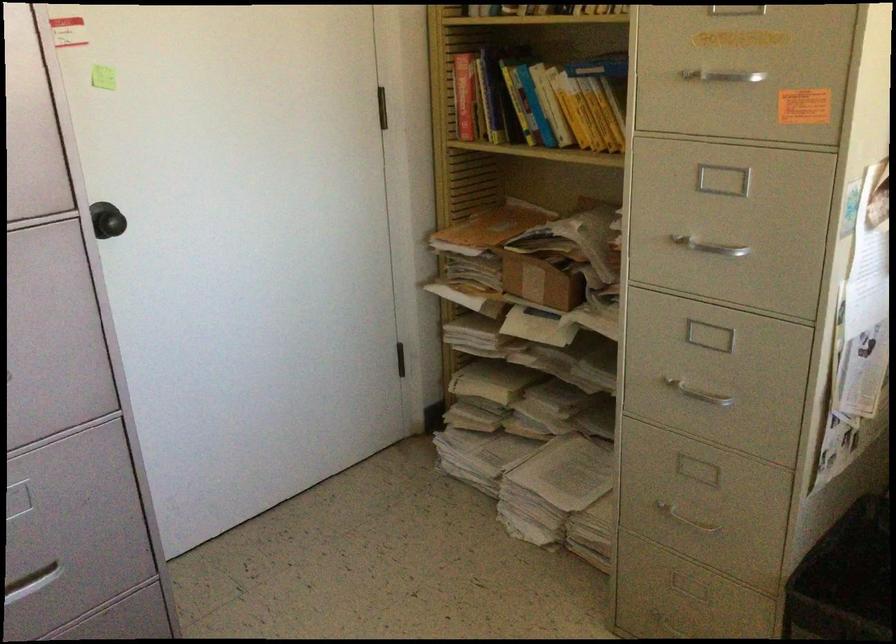
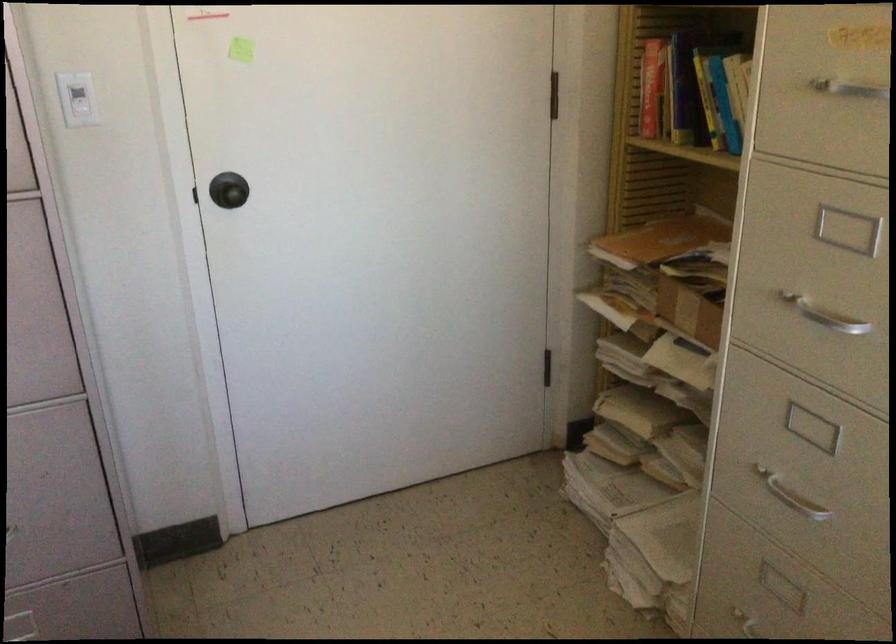
In a continuous first-person perspective shot, in which direction is the camera moving?

The cameraman walked toward right, forward.